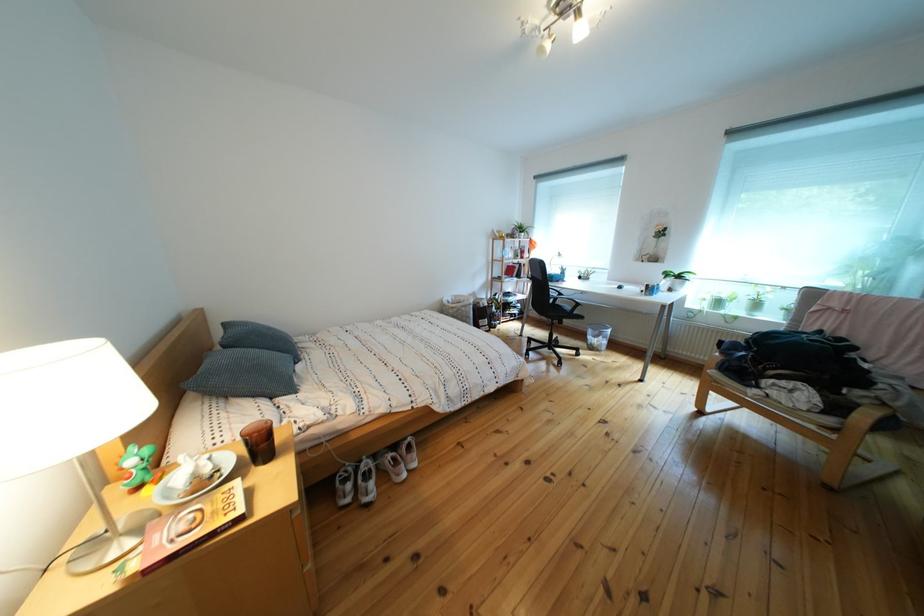
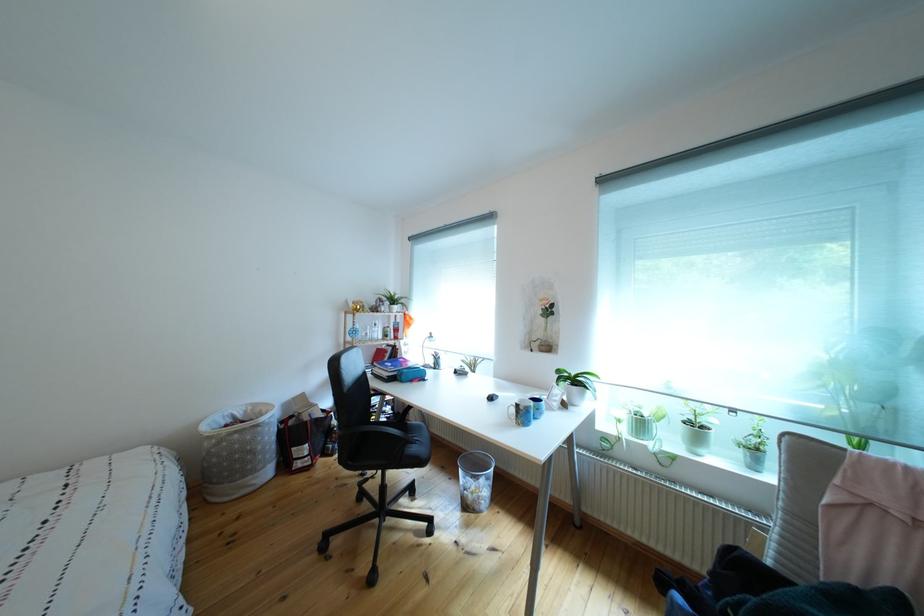
Where in the second image is the point corresponding to (603,354) from the first image?

(477, 512)